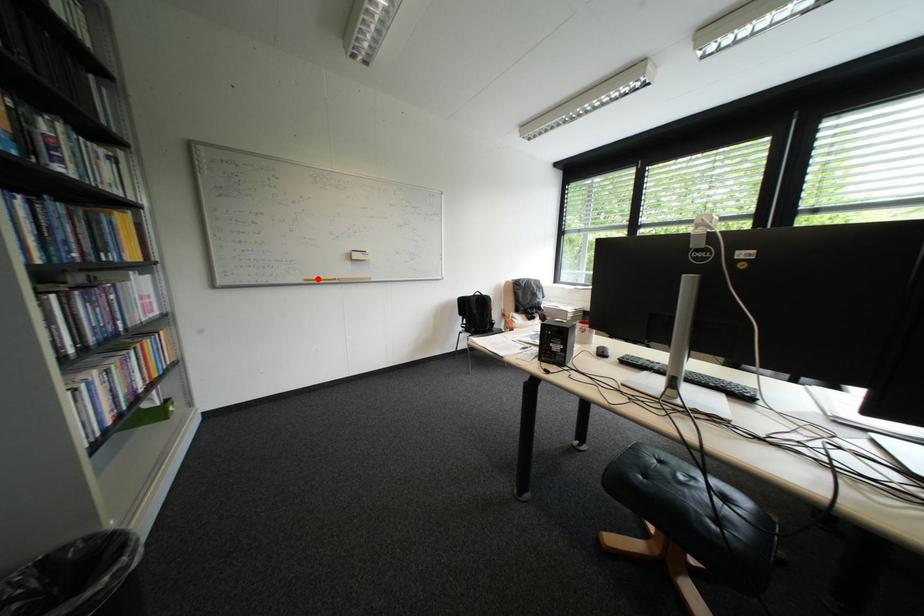
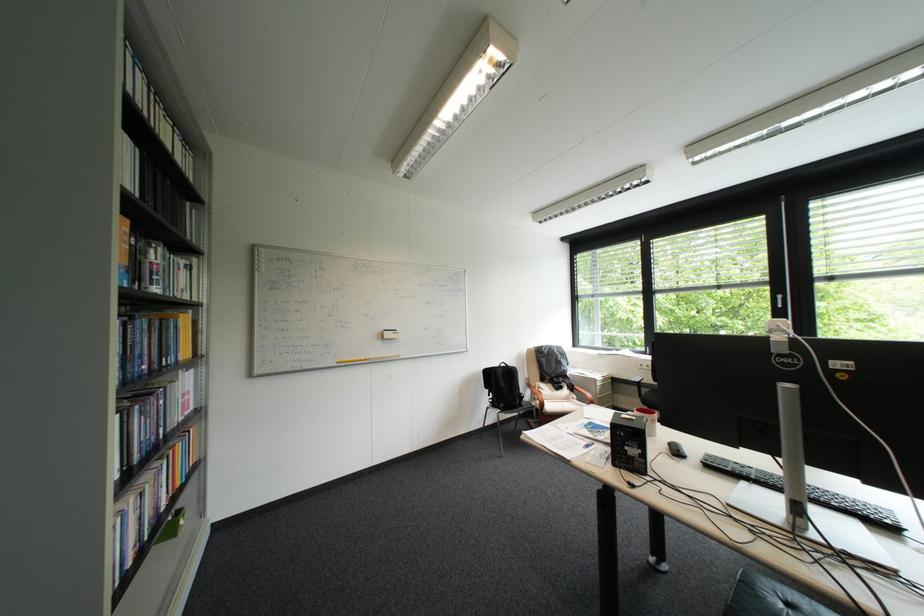
The point at the highlighted location is marked in the first image. Where is the corresponding point in the second image?

(350, 361)